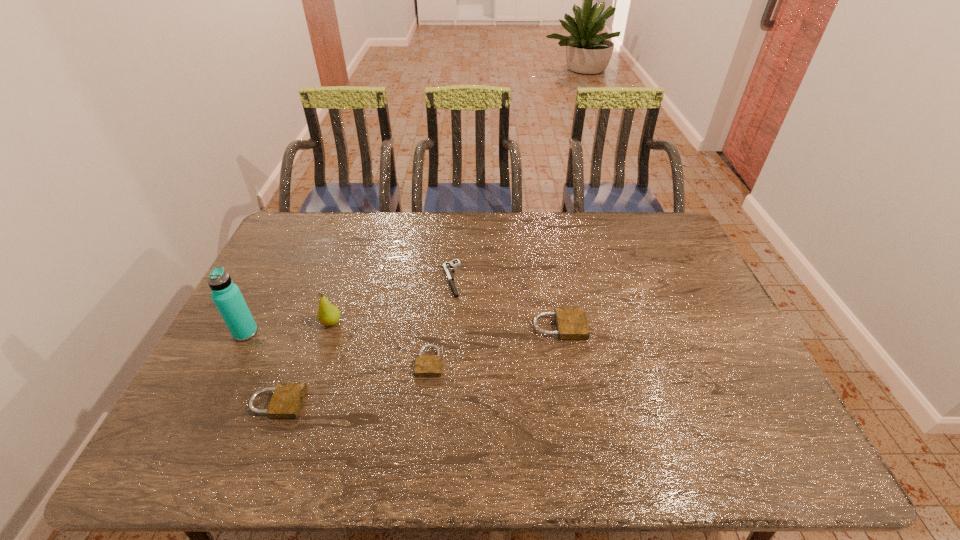
I want to click on object that can be found as the second closest to the leftmost padlock, so click(328, 314).

This screenshot has height=540, width=960. What are the coordinates of `padlock that stands as the closest to the fifth tallest object` in the screenshot? It's located at (571, 322).

Select which padlock is the second closest to the rightmost object. Please provide its 2D coordinates. Your answer should be formatted as a tuple, i.e. [(x, y)], where the tuple contains the x and y coordinates of a point satisfying the conditions above.

[(287, 399)]

The height and width of the screenshot is (540, 960). I want to click on vacant space that satisfies the following two spatial constraints: 1. on the front-facing side of the shortest object; 2. on the keyhole side of the second padlock from left to right, so click(444, 362).

This screenshot has width=960, height=540. Identify the location of free space that satisfies the following two spatial constraints: 1. on the keyhole side of the rightmost object; 2. on the keyhole side of the second nearest object. (565, 362).